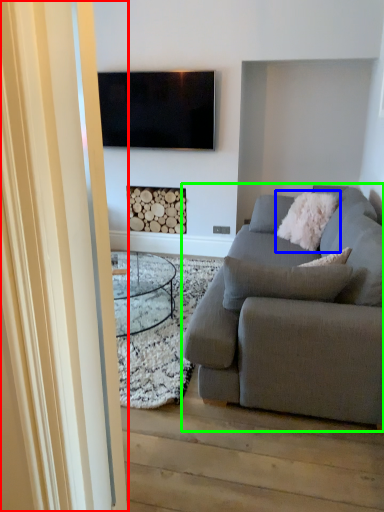
Question: Considering the real-world distances, which object is closest to glass door (highlighted by a red box)? pillow (highlighted by a blue box) or studio couch (highlighted by a green box).

Choices:
 (A) pillow
 (B) studio couch

Answer: (B)